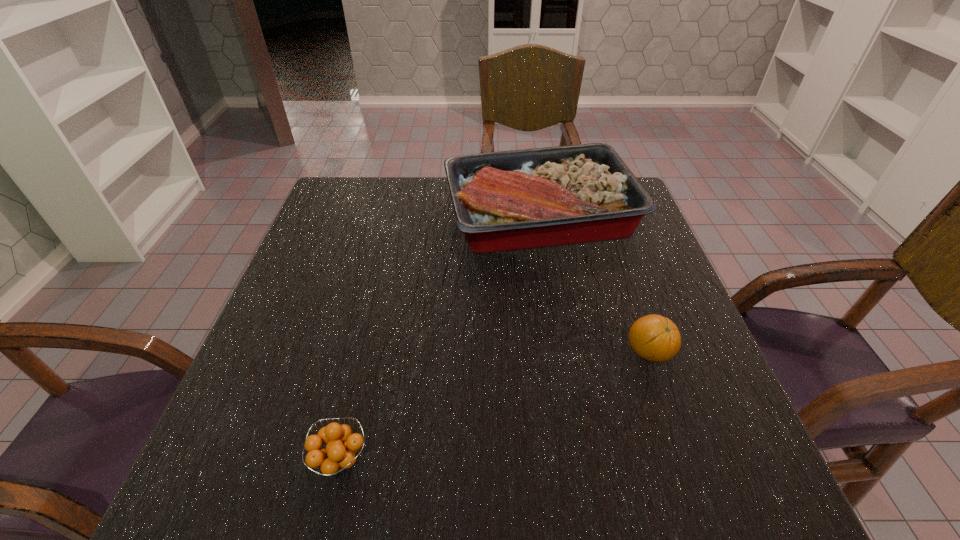
At what (x,y) coordinates should I click in order to perform the action: click on object at the near edge. Please return your answer as a coordinate pair (x, y). Image resolution: width=960 pixels, height=540 pixels. Looking at the image, I should click on (336, 456).

You are a GUI agent. You are given a task and a screenshot of the screen. Output one action in this format:
    pyautogui.click(x=<x>, y=<y>)
    Task: Click on the tray at the right edge
    Image resolution: width=960 pixels, height=540 pixels.
    Given the screenshot: What is the action you would take?
    pyautogui.click(x=510, y=200)

The width and height of the screenshot is (960, 540). Find the location of `orange that is positioned at the right edge`. orange that is positioned at the right edge is located at coordinates (654, 338).

Identify the location of object that is at the far right corner. (510, 200).

Where is `vacant point at the far edge`? vacant point at the far edge is located at coordinates (416, 192).

You are a GUI agent. You are given a task and a screenshot of the screen. Output one action in this format:
    pyautogui.click(x=<x>, y=<y>)
    Task: Click on the free space at the near edge of the desktop
    Image resolution: width=960 pixels, height=540 pixels.
    Given the screenshot: What is the action you would take?
    pyautogui.click(x=369, y=470)

In the image, there is a desktop. At what (x,y) coordinates should I click in order to perform the action: click on vacant space at the left edge. Please return your answer as a coordinate pair (x, y). The image size is (960, 540). Looking at the image, I should click on (333, 322).

Identify the location of vacant position at the right edge of the desktop. The image size is (960, 540). (625, 273).

Locate an element on the screen. The height and width of the screenshot is (540, 960). free space at the far left corner of the desktop is located at coordinates (370, 206).

This screenshot has height=540, width=960. Identify the location of unoccupied position between the leftmost object and the tray. (440, 338).